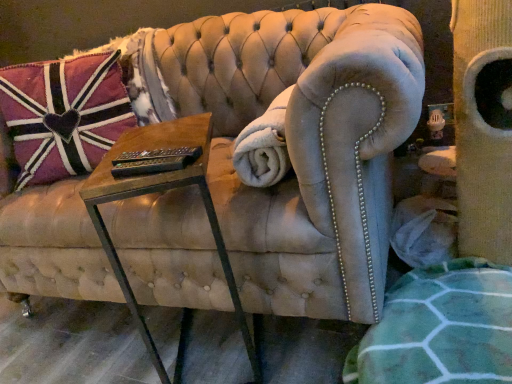
Question: Considering the positions of woodenmaterial/texturetable at center and white fluffy blanket at center in the image, is woodenmaterial/texturetable at center taller or shorter than white fluffy blanket at center?

Choices:
 (A) short
 (B) tall

Answer: (B)

Question: In the image, is woodenmaterial/texturetable at center positioned in front of or behind white fluffy blanket at center?

Choices:
 (A) front
 (B) behind

Answer: (A)

Question: Which is farther from the woodenmaterial/texturetable at center?

Choices:
 (A) white fluffy blanket at center
 (B) pink fabric pillow at upper left

Answer: (B)

Question: Which is nearer to the pink fabric pillow at upper left?

Choices:
 (A) white fluffy blanket at center
 (B) woodenmaterial/texturetable at center

Answer: (B)